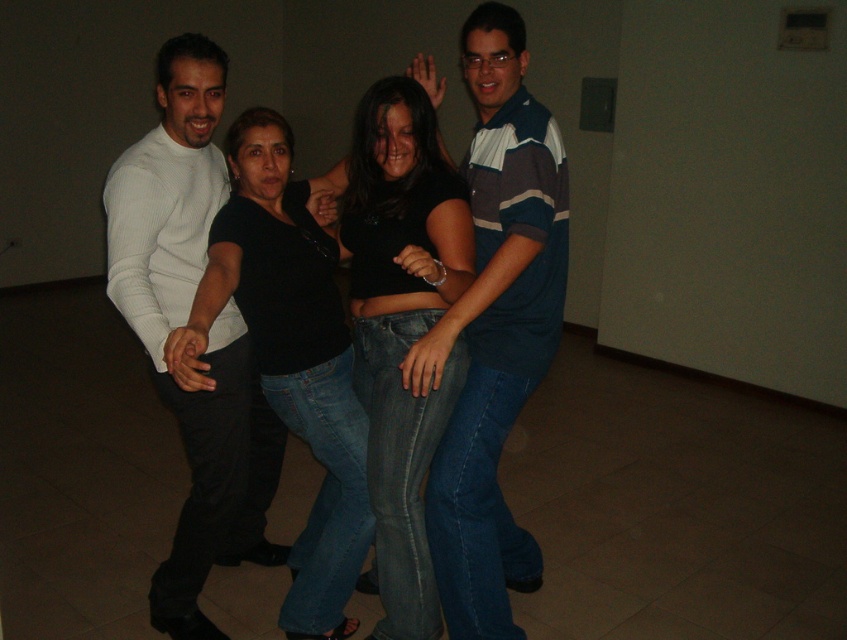
Is white ribbed sweater at left smaller than black matte shirt at center?

No.

Can you confirm if white ribbed sweater at left is bigger than black matte shirt at center?

Yes.

This screenshot has width=847, height=640. What do you see at coordinates (181, 324) in the screenshot? I see `white ribbed sweater at left` at bounding box center [181, 324].

Locate an element on the screen. white ribbed sweater at left is located at coordinates (181, 324).

Which is above, white ribbed sweater at left or black denim jeans at center?

black denim jeans at center

Which of these two, white ribbed sweater at left or black denim jeans at center, stands taller?

white ribbed sweater at left

Who is more forward, (165, 616) or (386, 83)?

Point (386, 83)

I want to click on white ribbed sweater at left, so click(181, 324).

From the picture: Between black denim jeans at center and black matte shirt at center, which one appears on the right side from the viewer's perspective?

Positioned to the right is black denim jeans at center.

Can you confirm if black denim jeans at center is wider than black matte shirt at center?

No.

Locate an element on the screen. Image resolution: width=847 pixels, height=640 pixels. black denim jeans at center is located at coordinates (402, 326).